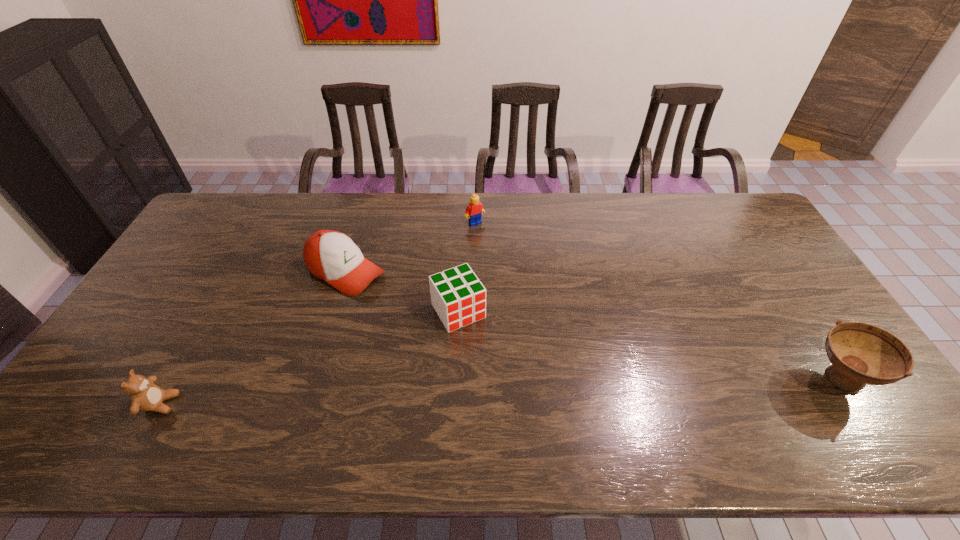
You are a GUI agent. You are given a task and a screenshot of the screen. Output one action in this format:
    pyautogui.click(x=<x>, y=<y>)
    Task: Click on the free space located 0.070m on the red face of the cube
    This screenshot has width=960, height=540.
    Given the screenshot: What is the action you would take?
    pyautogui.click(x=482, y=349)

Locate an element on the screen. free space located on the red face of the cube is located at coordinates [x=518, y=407].

Find the location of a particular element. vacant area situated 0.110m on the red face of the cube is located at coordinates (490, 360).

Image resolution: width=960 pixels, height=540 pixels. I want to click on vacant point located 0.100m on the front-facing side of the baseball cap, so click(401, 300).

The width and height of the screenshot is (960, 540). In order to click on vacant space located 0.210m on the front-facing side of the baseball cap in this screenshot , I will do (x=431, y=315).

You are a GUI agent. You are given a task and a screenshot of the screen. Output one action in this format:
    pyautogui.click(x=<x>, y=<y>)
    Task: Click on the free space located on the front-facing side of the baseball cap
    This screenshot has width=960, height=540.
    Given the screenshot: What is the action you would take?
    pyautogui.click(x=409, y=303)

Image resolution: width=960 pixels, height=540 pixels. Identify the location of object present at the far edge. (475, 208).

What are the coordinates of `teddy bear located in the near edge section of the desktop` in the screenshot? It's located at (145, 395).

Locate an element on the screen. soup bowl located at the near edge is located at coordinates (860, 353).

At what (x,y) coordinates should I click in order to perform the action: click on object situated at the right edge. Please return your answer as a coordinate pair (x, y). The width and height of the screenshot is (960, 540). Looking at the image, I should click on (860, 353).